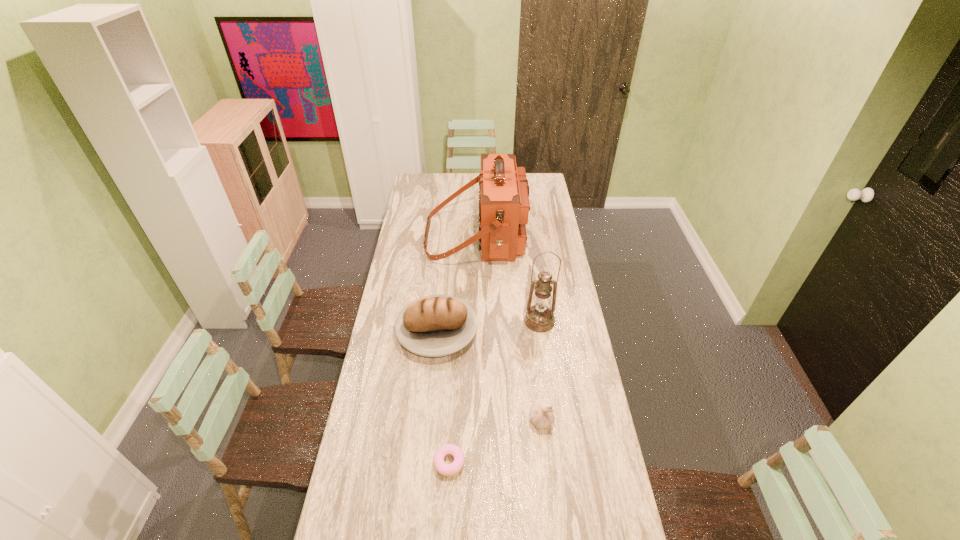
The height and width of the screenshot is (540, 960). Find the location of `vacant area between the oil lamp and the doughnut`. vacant area between the oil lamp and the doughnut is located at coordinates (494, 392).

Where is `free space between the bread and the fourth tallest object`? free space between the bread and the fourth tallest object is located at coordinates (489, 376).

Locate an element on the screen. unoccupied area between the garlic and the second tallest object is located at coordinates (540, 371).

The width and height of the screenshot is (960, 540). Identify the location of free spot between the garlic and the satchel. (509, 328).

This screenshot has height=540, width=960. I want to click on object that is the closest to the bread, so click(539, 318).

Locate an element on the screen. This screenshot has width=960, height=540. the closest object relative to the nearest object is located at coordinates (541, 417).

In order to click on vacant space that satisfies the following two spatial constraints: 1. on the face side of the satchel; 2. on the left side of the garlic in this screenshot , I will do `click(475, 421)`.

What are the coordinates of `vacant space that satisfies the following two spatial constraints: 1. on the back side of the fourth tallest object; 2. on the left side of the second tallest object` in the screenshot? It's located at (530, 321).

Where is `blank area in the image that satisfies the following two spatial constraints: 1. on the back side of the oil lamp; 2. on the face side of the satchel`? The height and width of the screenshot is (540, 960). blank area in the image that satisfies the following two spatial constraints: 1. on the back side of the oil lamp; 2. on the face side of the satchel is located at coordinates (528, 236).

Identify the location of vacant space that satisfies the following two spatial constraints: 1. on the face side of the second shortest object; 2. on the right side of the farthest object. This screenshot has height=540, width=960. (475, 421).